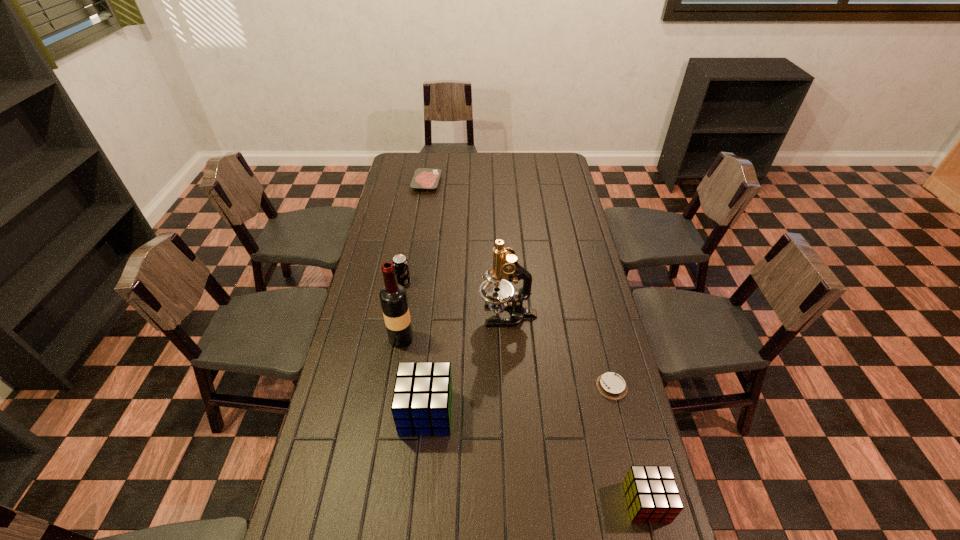
You are a GUI agent. You are given a task and a screenshot of the screen. Output one action in this format:
    pyautogui.click(x=<x>, y=<y>)
    Task: Click on the vacant position for inserting another cube evenly
    This screenshot has height=540, width=960.
    Given the screenshot: What is the action you would take?
    pyautogui.click(x=528, y=454)